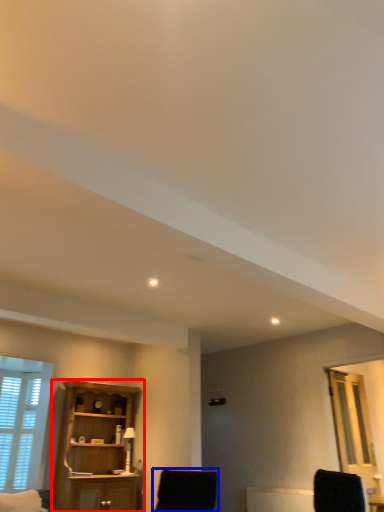
Question: Which object appears closest to the camera in this image, cupboard (highlighted by a red box) or chair (highlighted by a blue box)?

Choices:
 (A) cupboard
 (B) chair

Answer: (B)